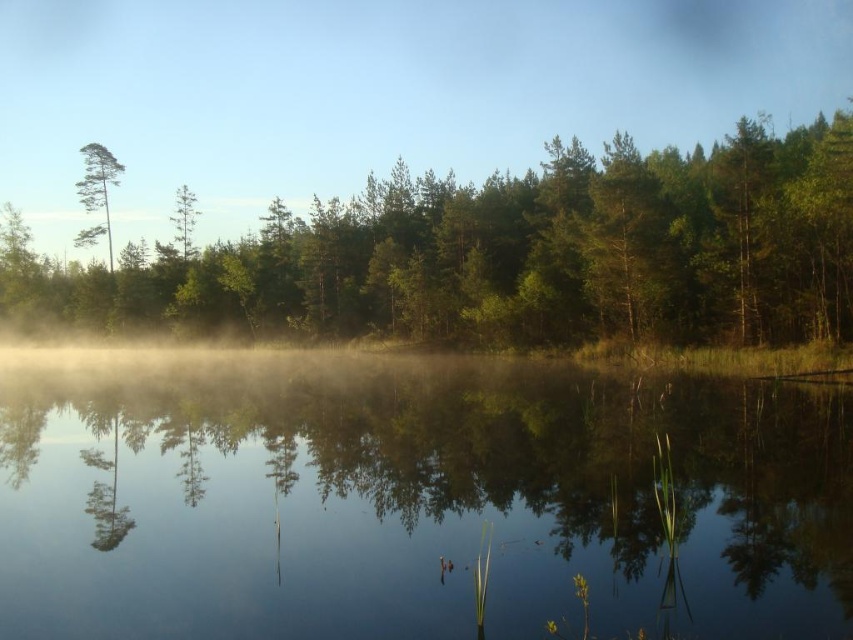
Between transparent water at center and green matte tree at upper center, which one appears on the right side from the viewer's perspective?

green matte tree at upper center is more to the right.

Image resolution: width=853 pixels, height=640 pixels. What are the coordinates of `transparent water at center` in the screenshot? It's located at click(410, 499).

You are a GUI agent. You are given a task and a screenshot of the screen. Output one action in this format:
    pyautogui.click(x=<x>, y=<y>)
    Task: Click on the transparent water at center
    This screenshot has height=640, width=853.
    Given the screenshot: What is the action you would take?
    pyautogui.click(x=410, y=499)

Is point (833, 328) positioned behind point (90, 195)?

That is False.

Between green matte tree at upper center and green matte tree at left, which one is positioned lower?

green matte tree at left

The width and height of the screenshot is (853, 640). I want to click on green matte tree at upper center, so click(514, 253).

Is point (90, 588) more distant than point (93, 237)?

No, (90, 588) is in front of (93, 237).

Looking at this image, which is below, transparent water at center or green matte tree at left?

Positioned lower is transparent water at center.

What are the coordinates of `transparent water at center` in the screenshot? It's located at (410, 499).

Where is `transparent water at center`? transparent water at center is located at coordinates (410, 499).